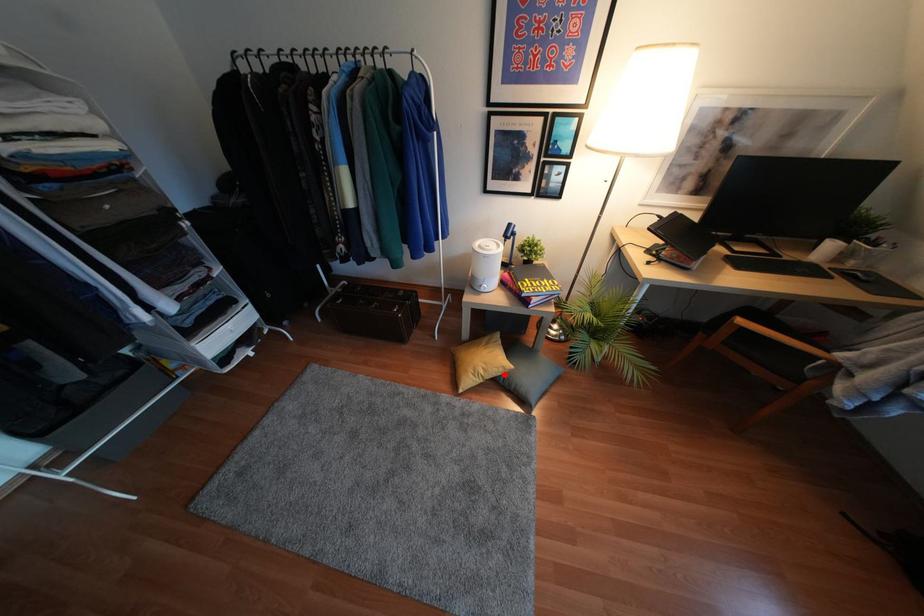
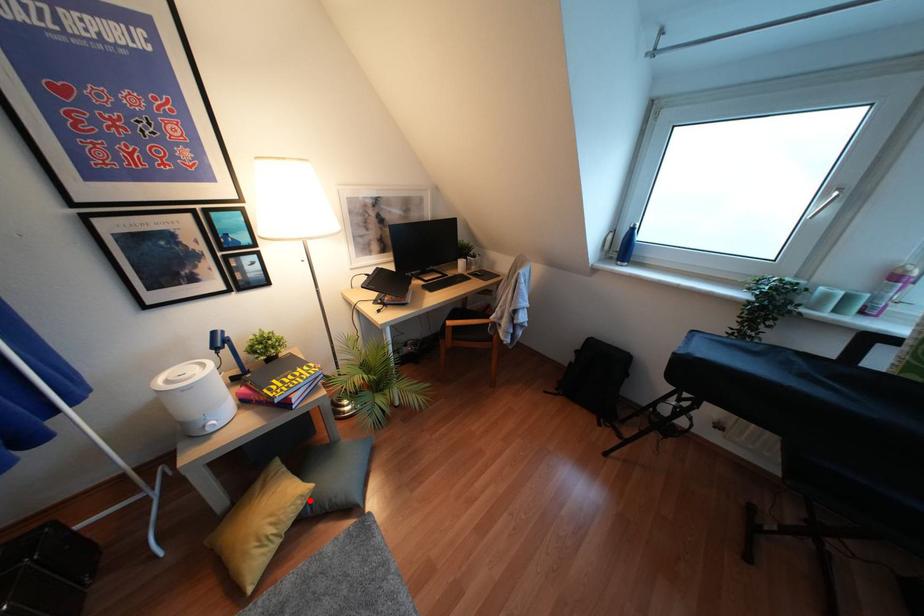
I am providing you with two images of the same scene from different viewpoints. A red point is marked on the first image and another point is marked on the second image. Is the marked point in image1 the same physical position as the marked point in image2?

Yes